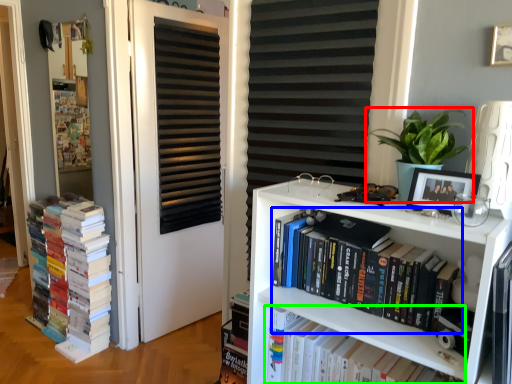
Question: Considering the real-world distances, which object is farthest from houseplant (highlighted by a red box)? book (highlighted by a blue box) or book (highlighted by a green box)?

Choices:
 (A) book
 (B) book

Answer: (B)